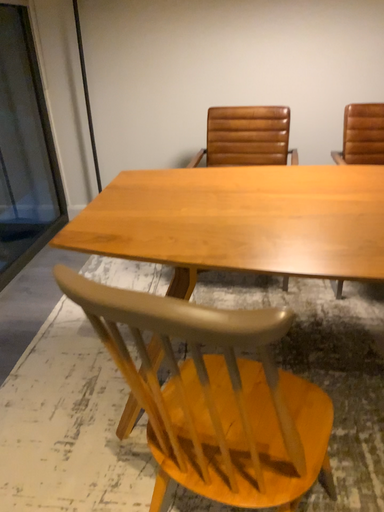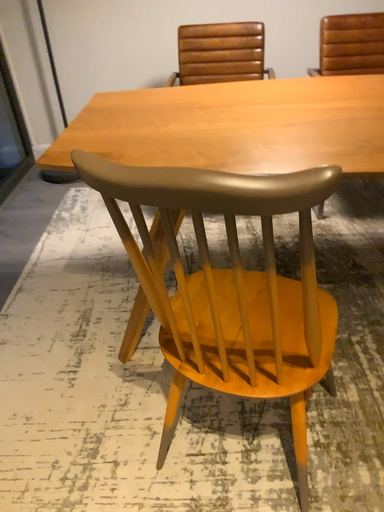
Question: Which way did the camera rotate in the video?

Choices:
 (A) rotated downward
 (B) rotated upward

Answer: (A)